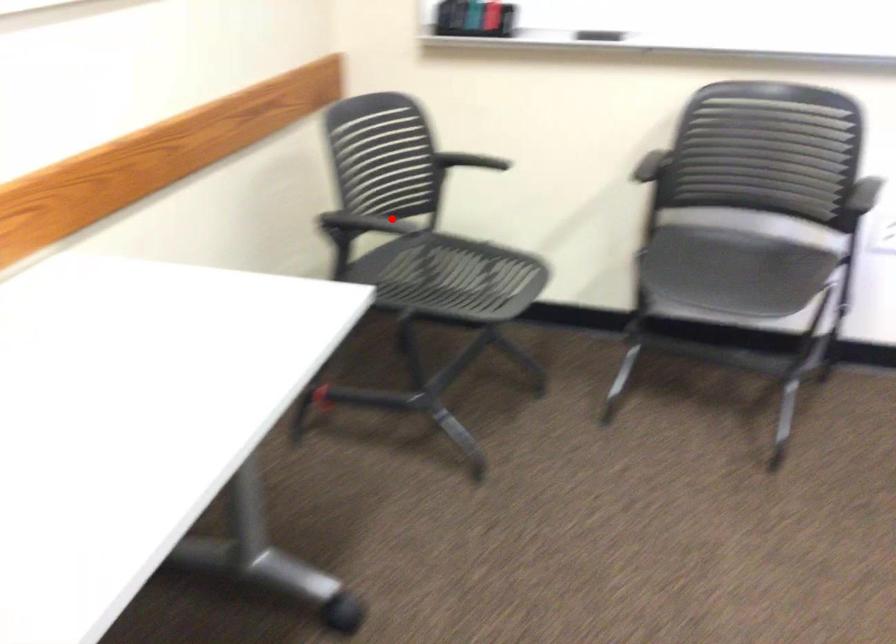
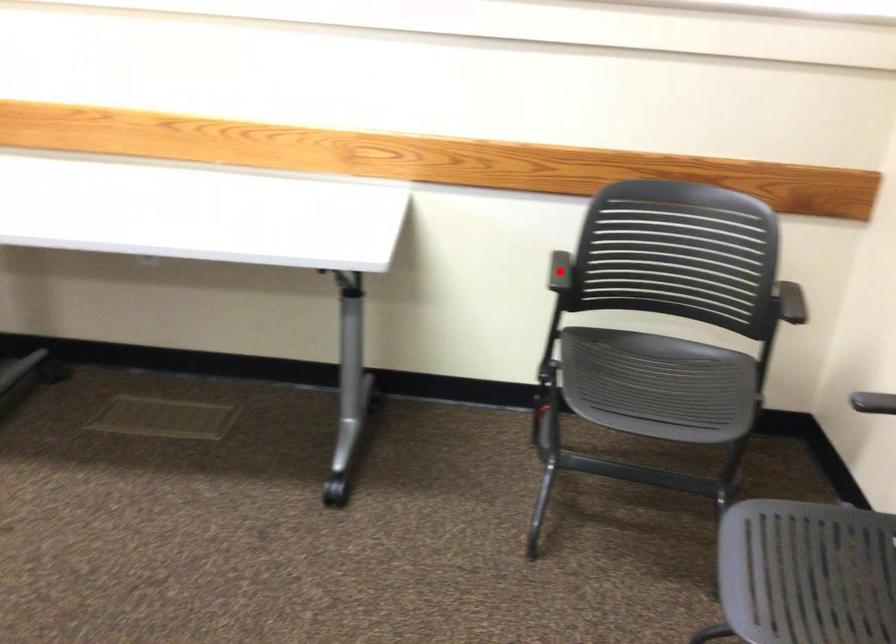
I am providing you with two images of the same scene from different viewpoints. A red point is marked on the first image and another point is marked on the second image. Does the point marked in image1 correspond to the same location as the one in image2?

Yes